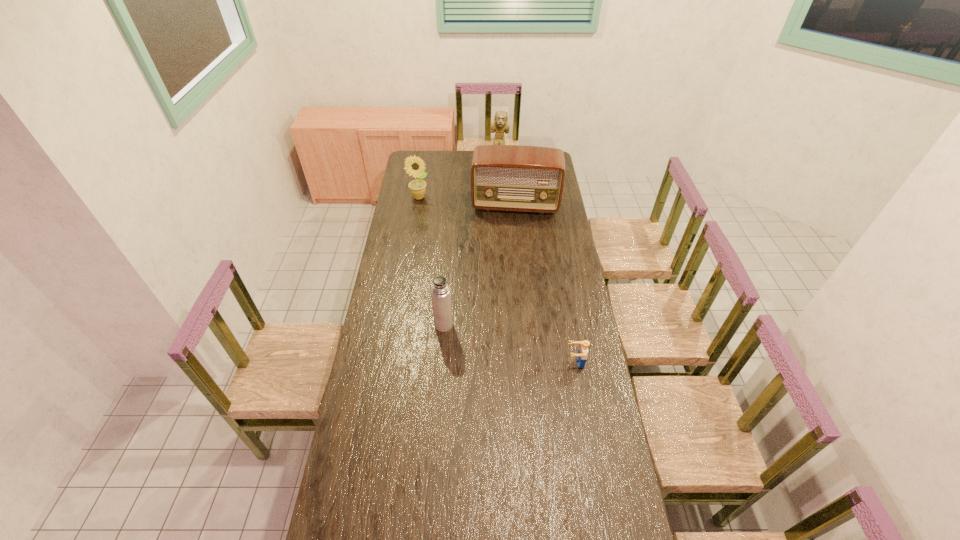
I want to click on vacant space located on the face of the nearest object, so click(x=516, y=362).

You are a GUI agent. You are given a task and a screenshot of the screen. Output one action in this format:
    pyautogui.click(x=<x>, y=<y>)
    Task: Click on the blank area located 0.190m on the face of the sunflower
    This screenshot has height=540, width=960.
    Given the screenshot: What is the action you would take?
    pyautogui.click(x=436, y=221)

The width and height of the screenshot is (960, 540). Find the location of `free region located on the face of the sunflower`. free region located on the face of the sunflower is located at coordinates (427, 208).

The height and width of the screenshot is (540, 960). Identify the location of vacant space positioned on the face of the sunflower. (429, 211).

Identify the location of vacant space situated 0.210m on the front-facing side of the radio receiver. point(512,243).

The image size is (960, 540). What are the coordinates of `free spot located 0.190m on the front-facing side of the radio receiver` in the screenshot? It's located at (512, 241).

The width and height of the screenshot is (960, 540). Find the location of `free spot located on the front-facing side of the radio receiver`. free spot located on the front-facing side of the radio receiver is located at coordinates (511, 261).

Where is `vacant space located on the front-facing side of the farthest object`? The width and height of the screenshot is (960, 540). vacant space located on the front-facing side of the farthest object is located at coordinates (498, 181).

Find the location of `free space located 0.090m on the front-facing side of the farthest object`. free space located 0.090m on the front-facing side of the farthest object is located at coordinates (498, 176).

Where is `vacant space located 0.290m on the front-facing side of the farthest object`? This screenshot has width=960, height=540. vacant space located 0.290m on the front-facing side of the farthest object is located at coordinates (498, 195).